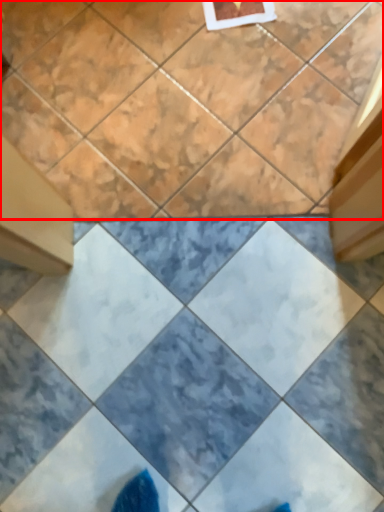
Question: From the image's perspective, what is the correct spatial positioning of ceramic tile (annotated by the red box) in reference to ceramic tile?

Choices:
 (A) above
 (B) below

Answer: (A)